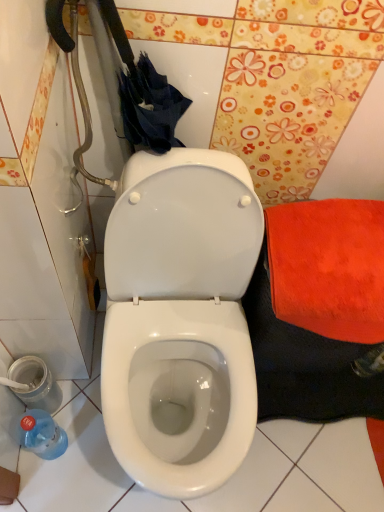
Question: From the image's perspective, is blue plastic bottle at lower left above or below metallic silver potty at lower left?

Choices:
 (A) below
 (B) above

Answer: (A)

Question: Is blue plastic bottle at lower left inside or outside of metallic silver potty at lower left?

Choices:
 (A) inside
 (B) outside

Answer: (B)

Question: Is blue plastic bottle at lower left bigger or smaller than metallic silver potty at lower left?

Choices:
 (A) big
 (B) small

Answer: (A)

Question: Does point (57, 390) appear closer or farther from the camera than point (36, 425)?

Choices:
 (A) farther
 (B) closer

Answer: (A)

Question: From the image's perspective, is metallic silver potty at lower left located above or below blue plastic bottle at lower left?

Choices:
 (A) below
 (B) above

Answer: (B)

Question: In the image, is metallic silver potty at lower left positioned in front of or behind blue plastic bottle at lower left?

Choices:
 (A) behind
 (B) front

Answer: (A)

Question: Do you think metallic silver potty at lower left is within blue plastic bottle at lower left, or outside of it?

Choices:
 (A) inside
 (B) outside

Answer: (B)